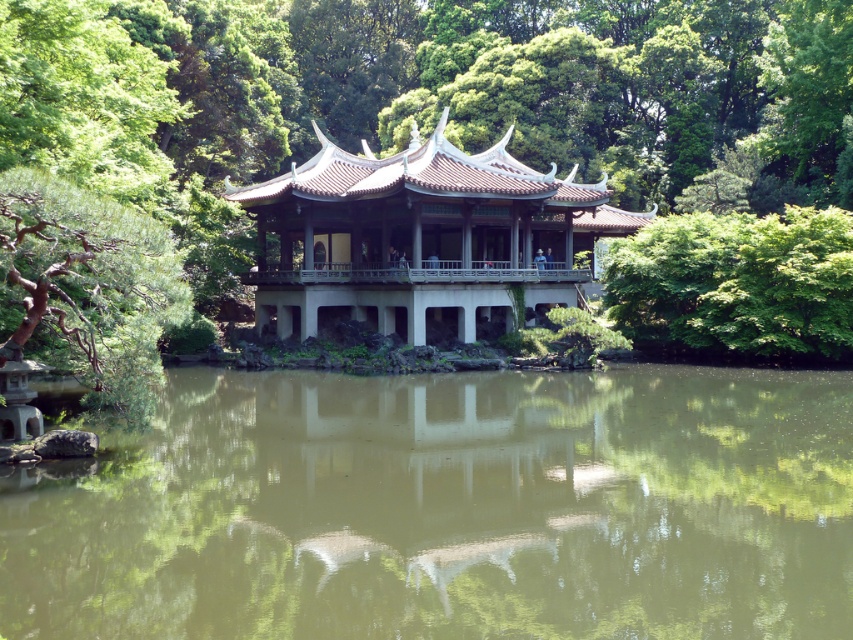
Question: Which object is farther from the camera taking this photo?

Choices:
 (A) green reflective water at center
 (B) matte gray gazebo at center

Answer: (B)

Question: Can you confirm if green reflective water at center is positioned above green leafy tree at center?

Choices:
 (A) yes
 (B) no

Answer: (B)

Question: Is green reflective water at center further to camera compared to green leafy tree at center?

Choices:
 (A) no
 (B) yes

Answer: (A)

Question: Which of these objects is positioned farthest from the matte gray gazebo at center?

Choices:
 (A) green reflective water at center
 (B) green leafy tree at center

Answer: (A)

Question: Which object is the farthest from the matte gray gazebo at center?

Choices:
 (A) green leafy tree at center
 (B) green reflective water at center

Answer: (B)

Question: Can you confirm if green reflective water at center is smaller than matte gray gazebo at center?

Choices:
 (A) yes
 (B) no

Answer: (A)